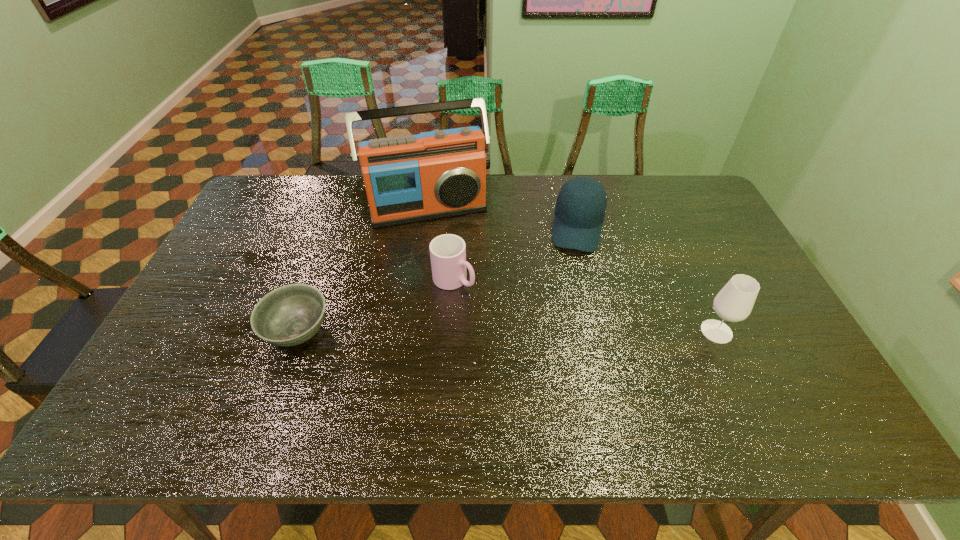
I want to click on radio receiver present at the far edge, so pos(437,174).

At what (x,y) coordinates should I click in order to perform the action: click on object that is positioned at the near edge. Please return your answer as a coordinate pair (x, y). This screenshot has width=960, height=540. Looking at the image, I should click on pos(290,315).

Find the location of a particular element. Image resolution: width=960 pixels, height=540 pixels. object situated at the right edge is located at coordinates (734, 303).

The height and width of the screenshot is (540, 960). In order to click on vacant space at the far edge in this screenshot , I will do `click(650, 181)`.

This screenshot has width=960, height=540. In order to click on blank area at the near edge in this screenshot , I will do `click(504, 377)`.

This screenshot has height=540, width=960. I want to click on vacant space at the left edge of the desktop, so click(262, 262).

The height and width of the screenshot is (540, 960). Find the location of `vacant area at the right edge`. vacant area at the right edge is located at coordinates (682, 219).

Where is `free space at the far left corner`? This screenshot has width=960, height=540. free space at the far left corner is located at coordinates (267, 178).

Image resolution: width=960 pixels, height=540 pixels. I want to click on vacant space at the far right corner, so click(664, 184).

At what (x,y) coordinates should I click in order to perform the action: click on free space between the cup and the third shortest object. Please return your answer as a coordinate pair (x, y). Looking at the image, I should click on coord(516,254).